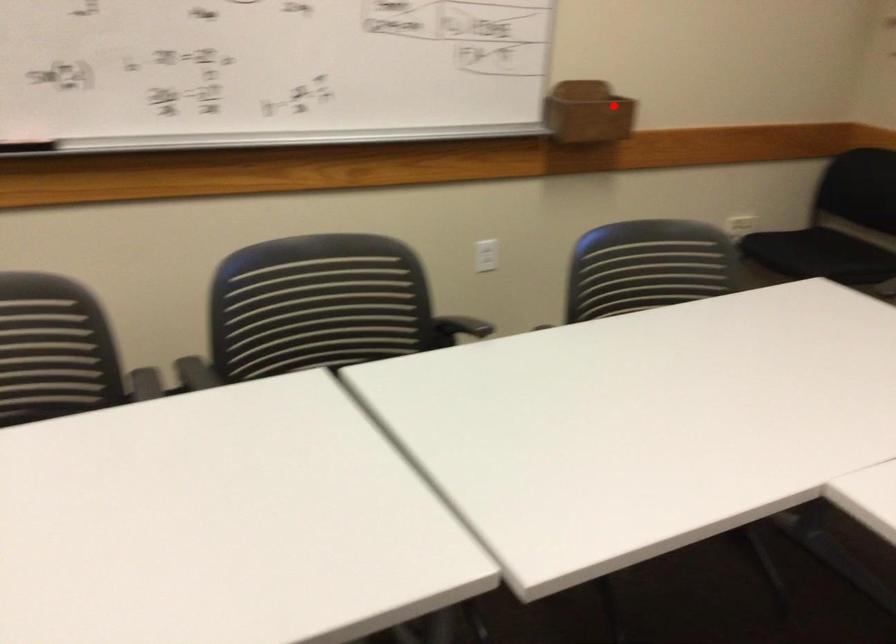
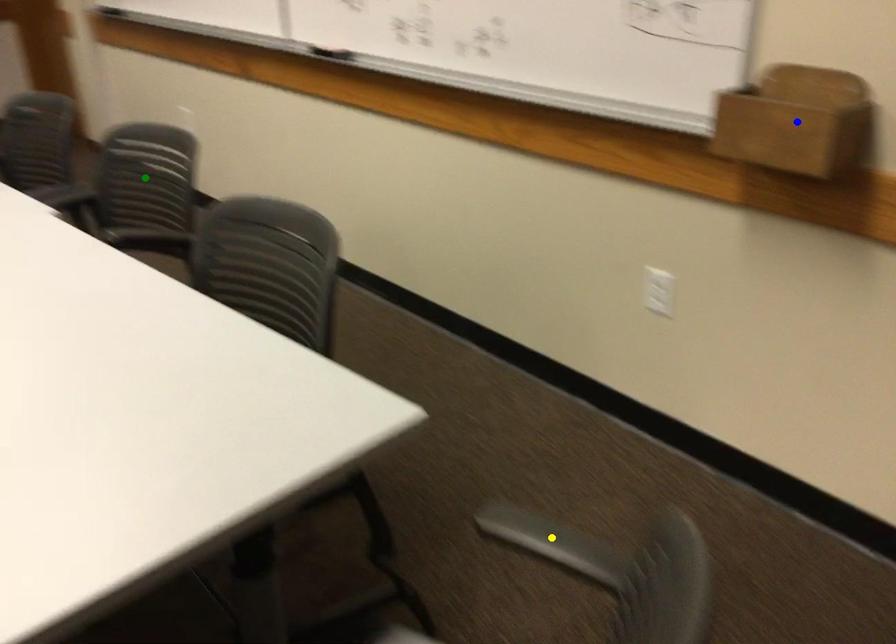
Question: I am providing you with two images of the same scene from different viewpoints. A red point is marked on the first image. You are given multiple points on the second image. Which point in image 2 is actually the same real-world point as the red point in image 1?

Choices:
 (A) yellow point
 (B) green point
 (C) blue point

Answer: (C)